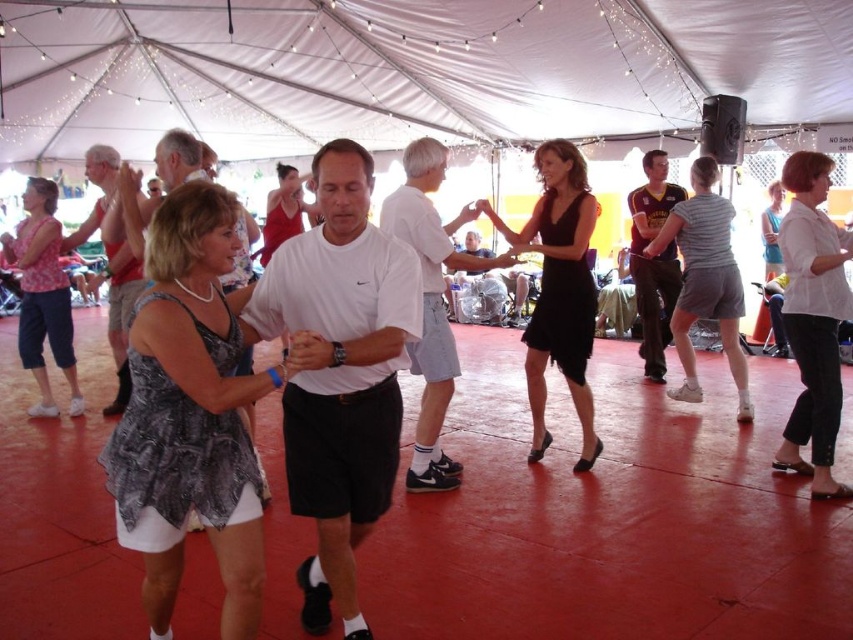
Question: Which object appears farthest from the camera in this image?

Choices:
 (A) maroon jersey at center
 (B) blue denim jeans at lower right

Answer: (B)

Question: Can you confirm if printed fabric dress at center is thinner than white matte t-shirt at center?

Choices:
 (A) no
 (B) yes

Answer: (B)

Question: In this image, where is white fabric canopy at upper center located relative to white cotton shirt at center?

Choices:
 (A) left
 (B) right

Answer: (A)

Question: Which of the following is the farthest from the observer?

Choices:
 (A) white cotton shirt at center
 (B) matte pink blouse at upper left
 (C) white fabric canopy at upper center

Answer: (C)

Question: Is black satin dress at center smaller than matte gray dress at center?

Choices:
 (A) no
 (B) yes

Answer: (A)

Question: Which of the following is the closest to the observer?

Choices:
 (A) matte gray dress at center
 (B) white fabric canopy at upper center
 (C) white cotton blouse at center

Answer: (A)